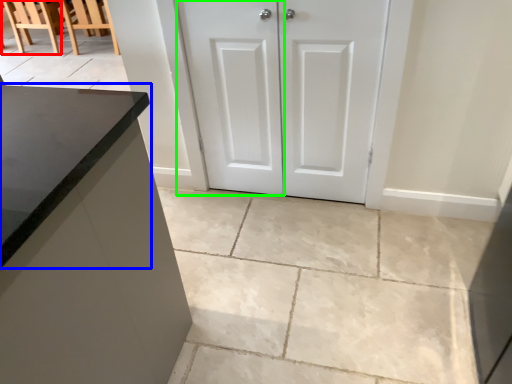
Question: Based on their relative distances, which object is farther from chair (highlighted by a red box)? Choose from countertop (highlighted by a blue box) and screen door (highlighted by a green box).

Choices:
 (A) countertop
 (B) screen door

Answer: (A)